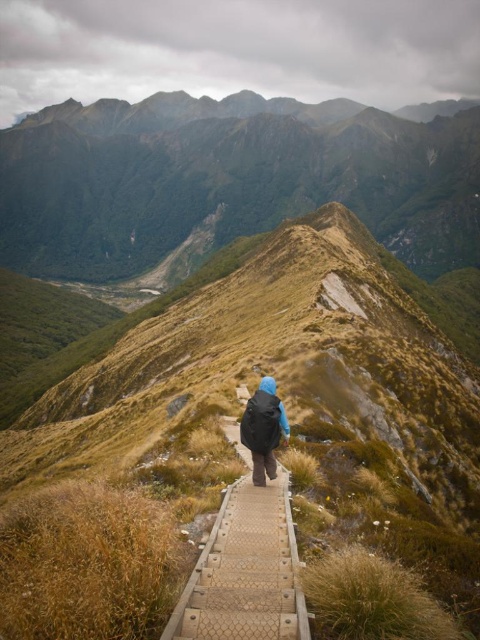
You are the hiker in the image. You want to take a photo of the blue matte jacket at center and the green mossy mountain at upper center. Which object should you point your camera towards first to capture both in the same frame?

You should point your camera towards the green mossy mountain at upper center first because it is to the left of the blue matte jacket at center, allowing both to be captured in the same frame.

You are a hiker on the boardwalk and want to know which area covers more ground between the brown grassy hill at center and the green mossy mountain at upper center. Which one is larger?

The green mossy mountain at upper center occupies more space than the brown grassy hill at center according to the description.